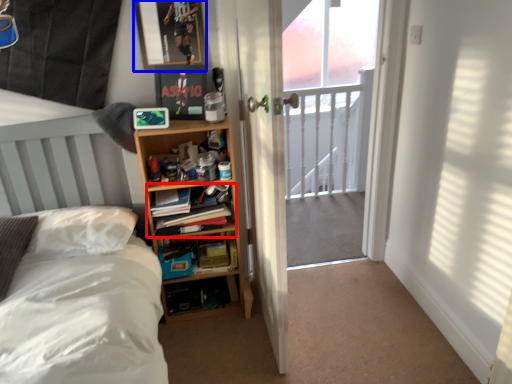
Question: Which object is closer to the camera taking this photo, book (highlighted by a red box) or picture frame (highlighted by a blue box)?

Choices:
 (A) book
 (B) picture frame

Answer: (B)